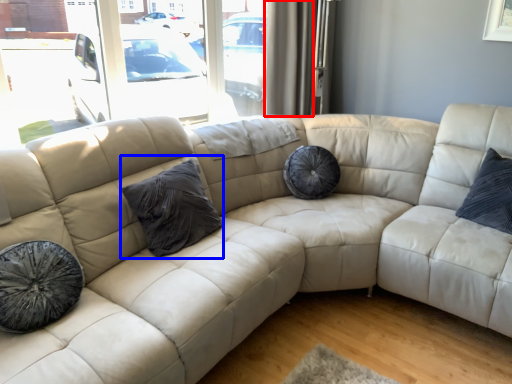
Question: Which point is further to the camera, curtain (highlighted by a red box) or pillow (highlighted by a blue box)?

Choices:
 (A) curtain
 (B) pillow

Answer: (A)